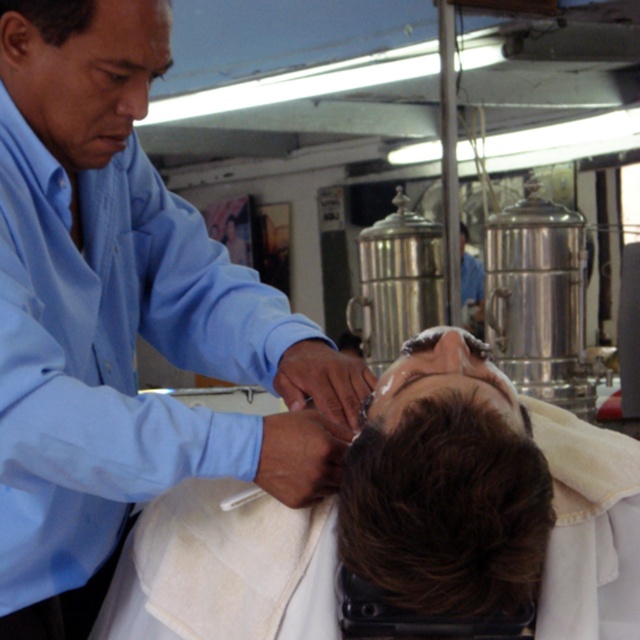
Question: Is smooth skin head at center further to camera compared to brown matte hair at center?

Choices:
 (A) no
 (B) yes

Answer: (B)

Question: Is smooth skin head at center positioned behind blue shirt at upper left?

Choices:
 (A) yes
 (B) no

Answer: (B)

Question: Considering the relative positions of smooth skin head at center and brown matte hair at center in the image provided, where is smooth skin head at center located with respect to brown matte hair at center?

Choices:
 (A) above
 (B) below

Answer: (B)

Question: Which of the following is the farthest from the observer?

Choices:
 (A) brown matte hair at center
 (B) smooth skin head at center
 (C) blue shirt at upper left

Answer: (C)

Question: Among these points, which one is farthest from the camera?

Choices:
 (A) (397, 426)
 (B) (632, 554)
 (C) (116, 13)

Answer: (B)

Question: Estimate the real-world distances between objects in this image. Which object is farther from the brown matte hair at center?

Choices:
 (A) smooth skin head at center
 (B) blue shirt at upper left

Answer: (B)